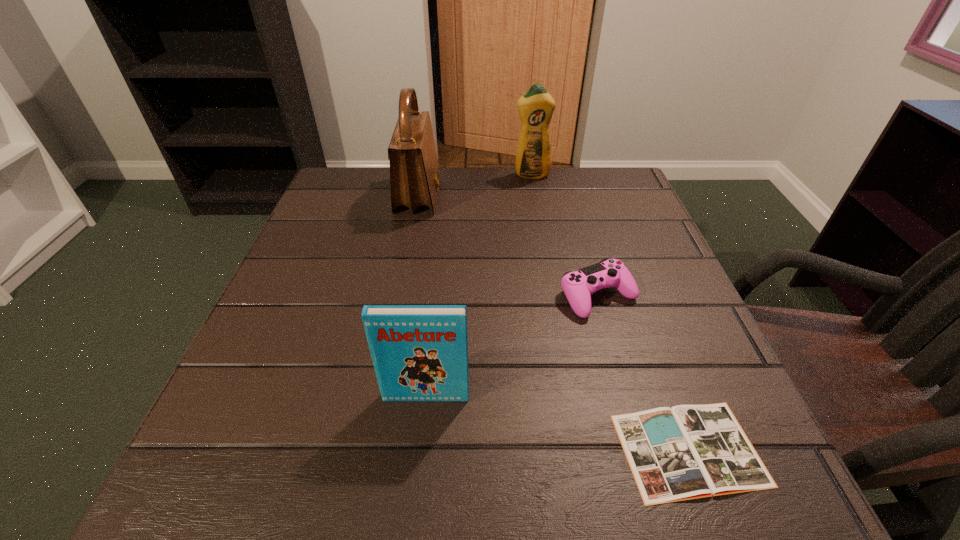
Where is `free space at the near edge of the desktop`? The image size is (960, 540). free space at the near edge of the desktop is located at coordinates (482, 474).

I want to click on vacant position at the left edge of the desktop, so click(x=260, y=364).

In the image, there is a desktop. What are the coordinates of `vacant space at the right edge` in the screenshot? It's located at (617, 227).

Locate an element on the screen. The width and height of the screenshot is (960, 540). free space at the far left corner is located at coordinates (347, 205).

The height and width of the screenshot is (540, 960). In the image, there is a desktop. Find the location of `free space at the far right corner`. free space at the far right corner is located at coordinates (572, 189).

Locate an element on the screen. The image size is (960, 540). free spot between the detergent and the third nearest object is located at coordinates (564, 235).

Find the location of a particular element. The width and height of the screenshot is (960, 540). free point between the nearest object and the fourth tallest object is located at coordinates (643, 373).

In order to click on empty location between the shoulder bag and the taller book in this screenshot , I will do `click(422, 296)`.

Locate an element on the screen. The width and height of the screenshot is (960, 540). free space between the detergent and the left book is located at coordinates (479, 286).

You are a GUI agent. You are given a task and a screenshot of the screen. Output one action in this format:
    pyautogui.click(x=<x>, y=<y>)
    Task: Click on the free spot between the shoulder bag and the control
    The height and width of the screenshot is (540, 960).
    Given the screenshot: What is the action you would take?
    (508, 246)